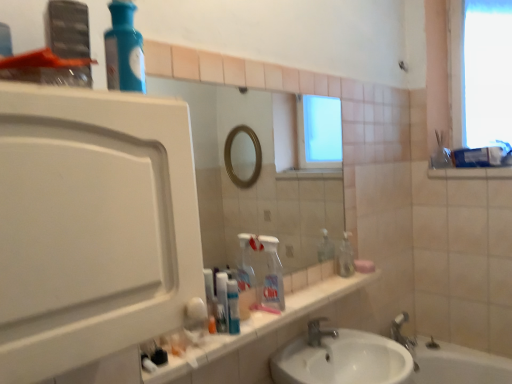
Question: Is white matte cabinet at left with white plastic toothpaste tube at center?

Choices:
 (A) no
 (B) yes

Answer: (A)

Question: From the image's perspective, would you say white matte cabinet at left is shown under white plastic toothpaste tube at center?

Choices:
 (A) yes
 (B) no

Answer: (B)

Question: Considering the relative positions of white matte cabinet at left and white plastic toothpaste tube at center in the image provided, is white matte cabinet at left in front of white plastic toothpaste tube at center?

Choices:
 (A) yes
 (B) no

Answer: (A)

Question: Could you tell me if white matte cabinet at left is facing white plastic toothpaste tube at center?

Choices:
 (A) no
 (B) yes

Answer: (A)

Question: Could white plastic toothpaste tube at center be considered to be inside white matte cabinet at left?

Choices:
 (A) no
 (B) yes

Answer: (A)

Question: Is silver metallic faucet at sink center spatially inside white glossy sink at lower center, or outside of it?

Choices:
 (A) outside
 (B) inside

Answer: (B)

Question: Based on their sizes in the image, would you say silver metallic faucet at sink center is bigger or smaller than white glossy sink at lower center?

Choices:
 (A) small
 (B) big

Answer: (A)

Question: Relative to white glossy sink at lower center, is silver metallic faucet at sink center in front or behind?

Choices:
 (A) behind
 (B) front

Answer: (A)

Question: From the image's perspective, is silver metallic faucet at sink center above or below white glossy sink at lower center?

Choices:
 (A) below
 (B) above

Answer: (B)

Question: Is white plastic toothpaste tube at center in front of or behind white glossy sink at lower center in the image?

Choices:
 (A) behind
 (B) front

Answer: (A)

Question: Would you say white plastic toothpaste tube at center is to the left or to the right of white glossy sink at lower center in the picture?

Choices:
 (A) left
 (B) right

Answer: (A)

Question: Is white plastic toothpaste tube at center spatially inside white glossy sink at lower center, or outside of it?

Choices:
 (A) outside
 (B) inside

Answer: (A)

Question: Is white plastic toothpaste tube at center bigger or smaller than white glossy sink at lower center?

Choices:
 (A) big
 (B) small

Answer: (B)

Question: Considering their positions, is white plastic toothpaste tube at center located in front of or behind blue glass bottle at upper left, the second cleaning product viewed from the right?

Choices:
 (A) behind
 (B) front

Answer: (A)

Question: Based on their positions, is white plastic toothpaste tube at center located to the left or right of blue glass bottle at upper left, the 1th cleaning product viewed from the top?

Choices:
 (A) right
 (B) left

Answer: (A)